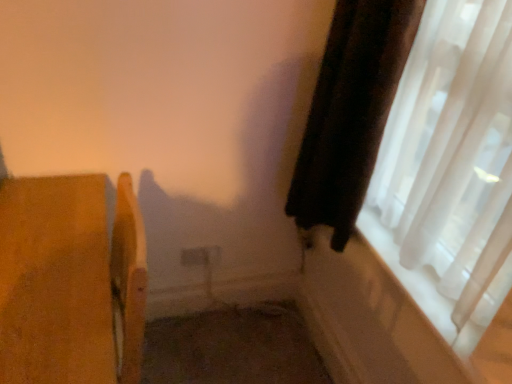
Question: Looking at their shapes, would you say wooden chair at left is wider or thinner than velvet dark brown curtain at right?

Choices:
 (A) thin
 (B) wide

Answer: (B)

Question: Is point (84, 339) positioned closer to the camera than point (344, 21)?

Choices:
 (A) closer
 (B) farther

Answer: (A)

Question: Estimate the real-world distances between objects in this image. Which object is closer to the velvet dark brown curtain at right?

Choices:
 (A) wooden chair at left
 (B) translucent white curtain at right

Answer: (B)

Question: Which object is the farthest from the translucent white curtain at right?

Choices:
 (A) wooden chair at left
 (B) velvet dark brown curtain at right

Answer: (A)